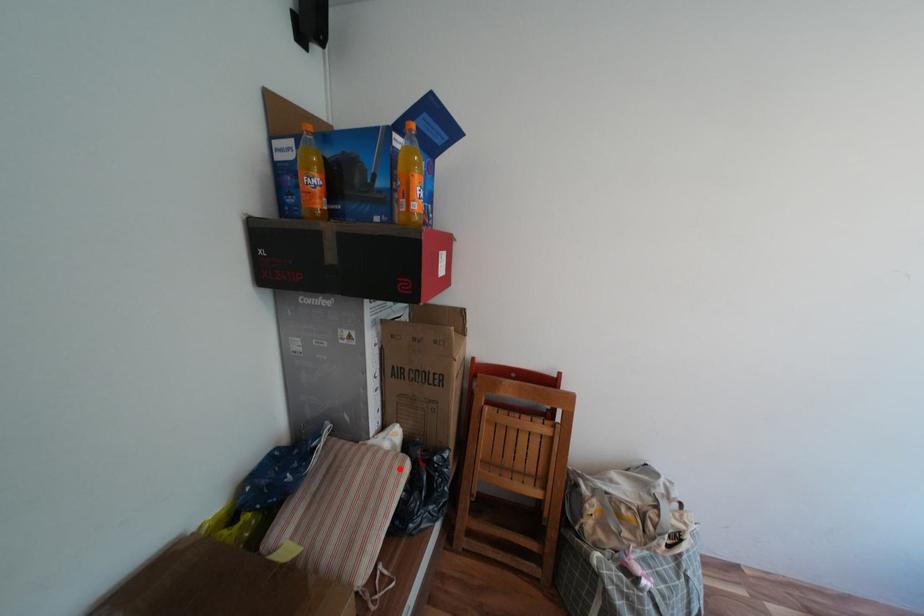
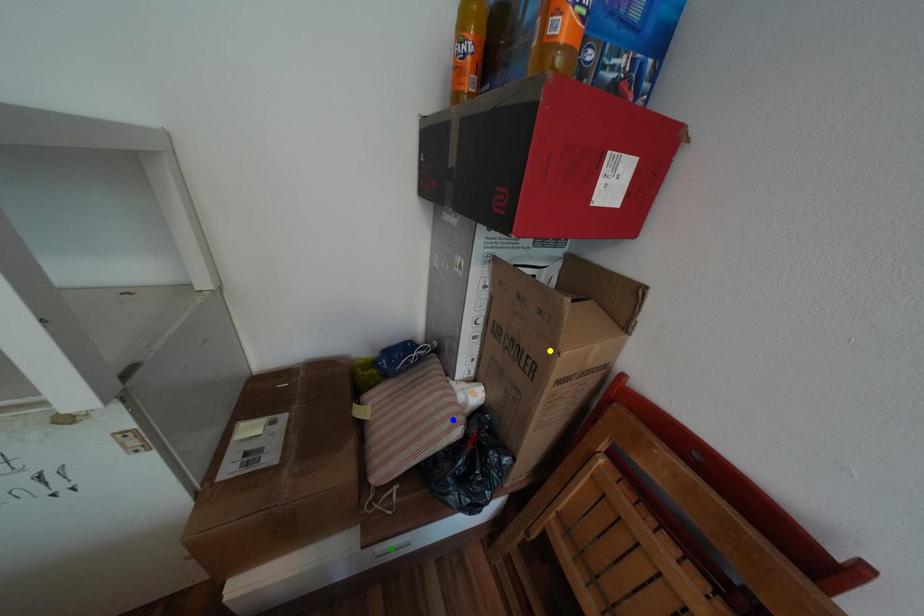
Question: I am providing you with two images of the same scene from different viewpoints. A red point is marked on the first image. You are given multiple points on the second image. Can you choose the point in image 2 that corresponds to the point in image 1?

Choices:
 (A) blue point
 (B) yellow point
 (C) green point

Answer: (A)